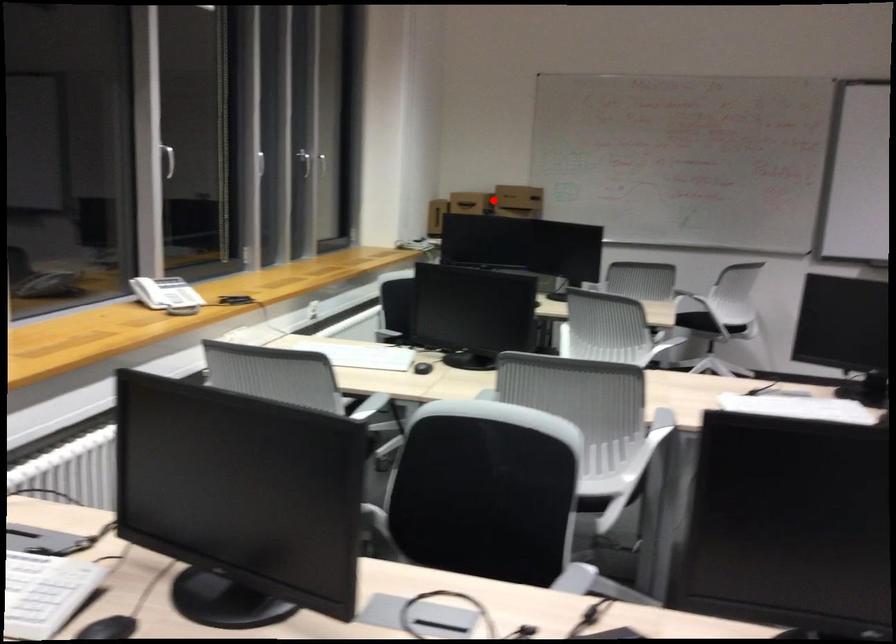
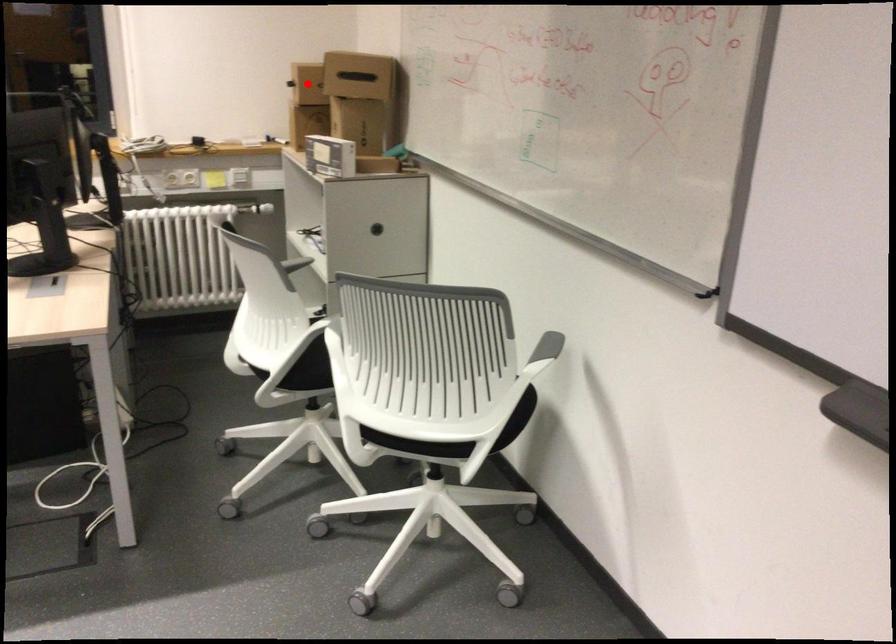
I am providing you with two images of the same scene from different viewpoints. A red point is marked on the first image and another point is marked on the second image. Are the points marked in image1 and image2 representing the same 3D position?

Yes